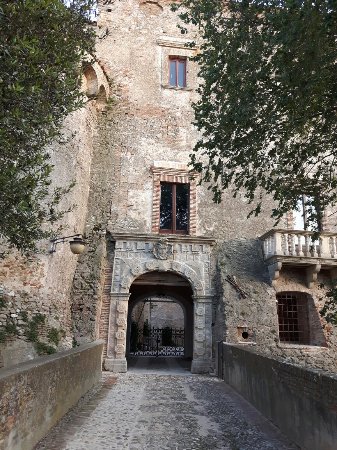
Find the location of a particular element. light is located at coordinates (71, 245).